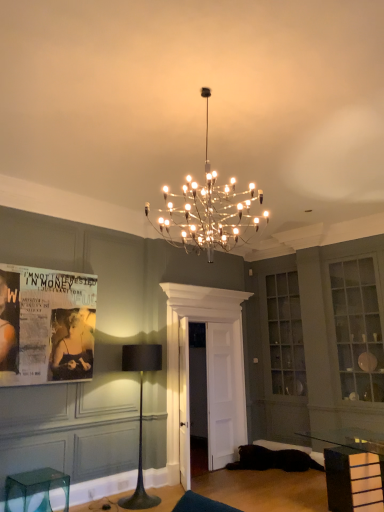
Question: Is clear glass table at lower right far away from black fabric lamp at center?

Choices:
 (A) no
 (B) yes

Answer: (B)

Question: Is clear glass table at lower right in front of black fabric lamp at center?

Choices:
 (A) no
 (B) yes

Answer: (B)

Question: Does clear glass table at lower right have a lesser width compared to black fabric lamp at center?

Choices:
 (A) yes
 (B) no

Answer: (B)

Question: From the image's perspective, is clear glass table at lower right below black fabric lamp at center?

Choices:
 (A) yes
 (B) no

Answer: (A)

Question: Is clear glass table at lower right facing towards black fabric lamp at center?

Choices:
 (A) no
 (B) yes

Answer: (A)

Question: Considering the positions of matte paper poster at left and clear glass table at lower right in the image, is matte paper poster at left bigger or smaller than clear glass table at lower right?

Choices:
 (A) big
 (B) small

Answer: (B)

Question: From the image's perspective, relative to clear glass table at lower right, is matte paper poster at left above or below?

Choices:
 (A) above
 (B) below

Answer: (A)

Question: Is matte paper poster at left situated inside clear glass table at lower right or outside?

Choices:
 (A) outside
 (B) inside

Answer: (A)

Question: Based on their positions, is matte paper poster at left located to the left or right of clear glass table at lower right?

Choices:
 (A) right
 (B) left

Answer: (B)

Question: Considering the positions of transparent plastic stool at lower left and clear glass cabinet at upper right in the image, is transparent plastic stool at lower left taller or shorter than clear glass cabinet at upper right?

Choices:
 (A) short
 (B) tall

Answer: (A)

Question: Is point (23, 480) positioned closer to the camera than point (344, 278)?

Choices:
 (A) farther
 (B) closer

Answer: (B)

Question: Is transparent plastic stool at lower left inside the boundaries of clear glass cabinet at upper right, or outside?

Choices:
 (A) inside
 (B) outside

Answer: (B)

Question: Based on their sizes in the image, would you say transparent plastic stool at lower left is bigger or smaller than clear glass cabinet at upper right?

Choices:
 (A) small
 (B) big

Answer: (A)

Question: From the image's perspective, is transparent plastic stool at lower left above or below black fabric lamp at center?

Choices:
 (A) above
 (B) below

Answer: (B)

Question: Relative to black fabric lamp at center, is transparent plastic stool at lower left in front or behind?

Choices:
 (A) front
 (B) behind

Answer: (A)